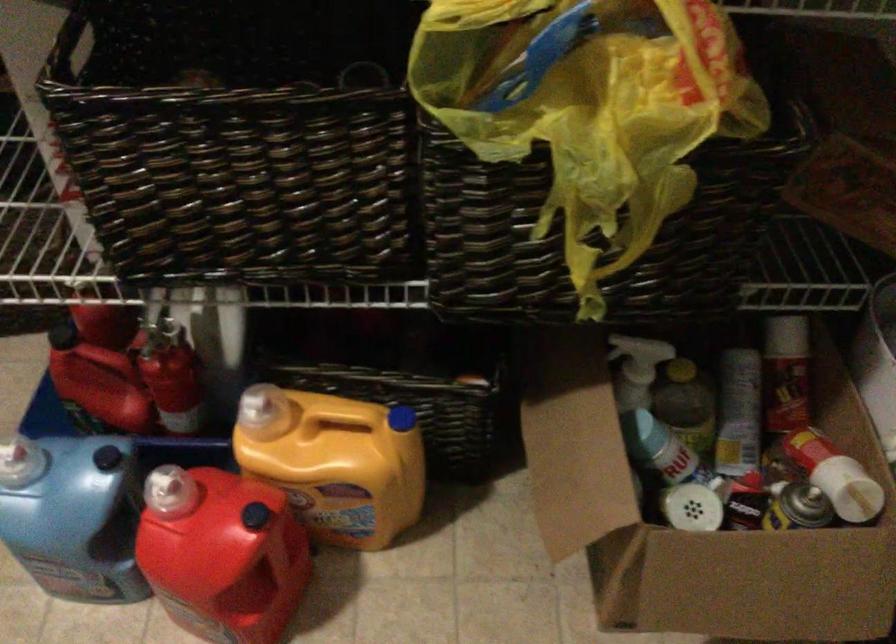
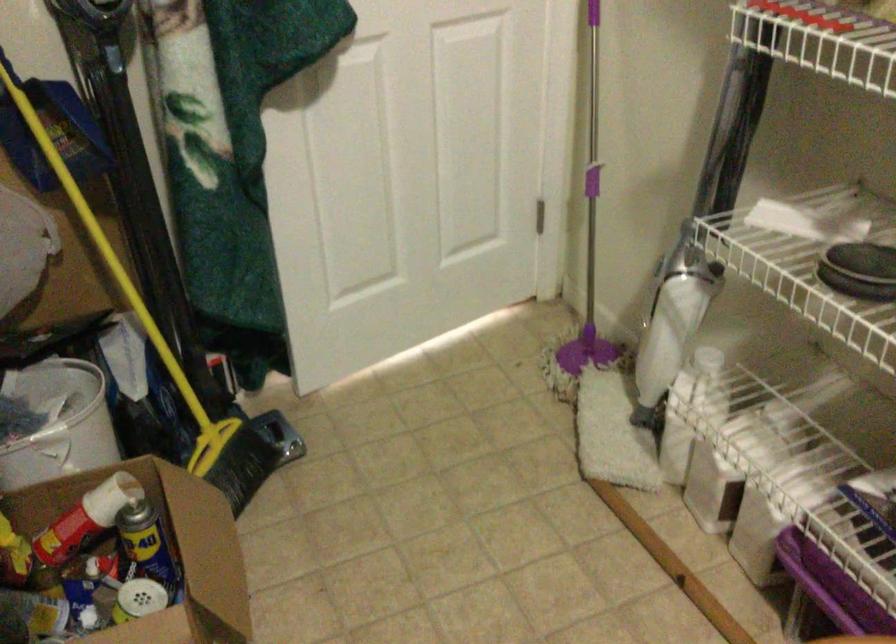
How did the camera likely rotate?

The camera's rotation is toward right-down.